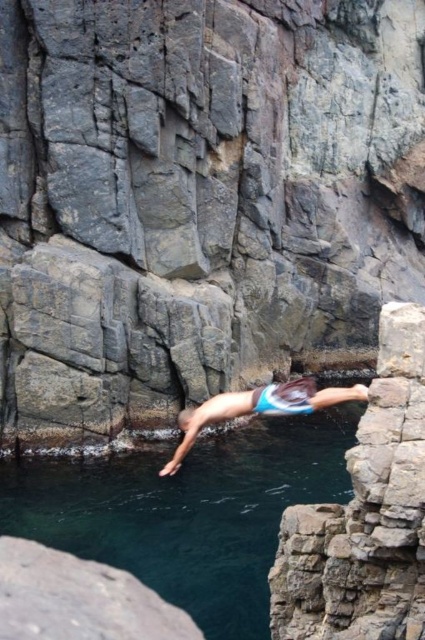
Question: Based on their relative distances, which object is nearer to the clear blue water at center?

Choices:
 (A) gray rock cliff at center
 (B) blue swim trunks at center

Answer: (B)

Question: Is gray rock cliff at center closer to the viewer compared to clear blue water at center?

Choices:
 (A) yes
 (B) no

Answer: (B)

Question: Which point is closer to the camera?

Choices:
 (A) blue swim trunks at center
 (B) gray rock cliff at center
 (C) clear blue water at center

Answer: (A)

Question: Can you confirm if clear blue water at center is positioned above blue swim trunks at center?

Choices:
 (A) yes
 (B) no

Answer: (B)

Question: Which point is closer to the camera taking this photo?

Choices:
 (A) (258, 353)
 (B) (237, 410)
 (C) (141, 474)

Answer: (B)

Question: Can you confirm if gray rock cliff at center is positioned below blue swim trunks at center?

Choices:
 (A) no
 (B) yes

Answer: (A)